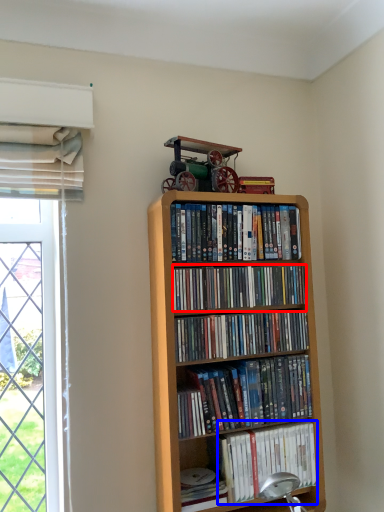
Question: Which object is closer to the camera taking this photo, book (highlighted by a red box) or book (highlighted by a blue box)?

Choices:
 (A) book
 (B) book

Answer: (A)